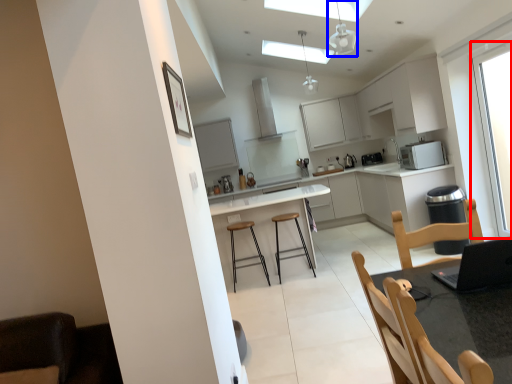
Question: Which point is further to the camera, window (highlighted by a red box) or light fixture (highlighted by a blue box)?

Choices:
 (A) window
 (B) light fixture

Answer: (A)